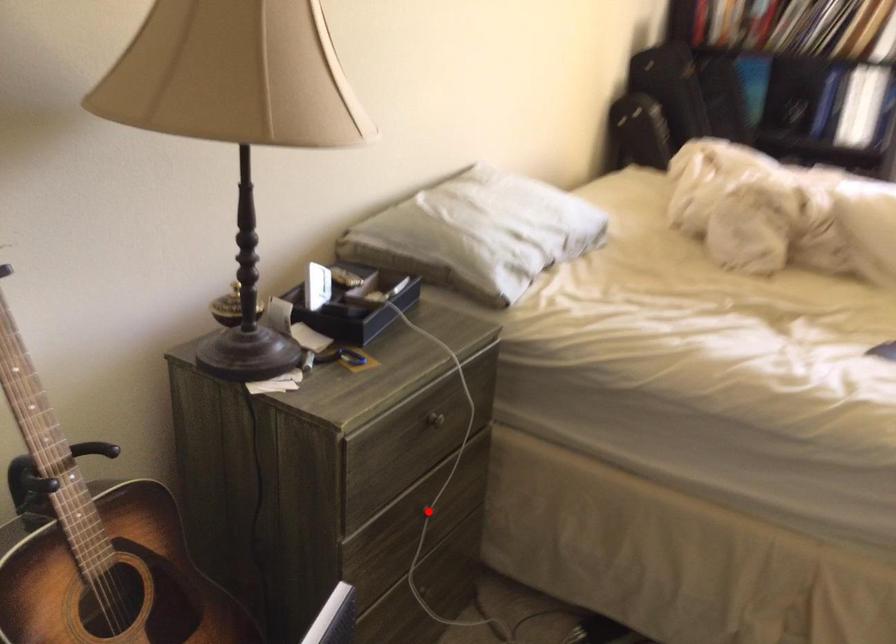
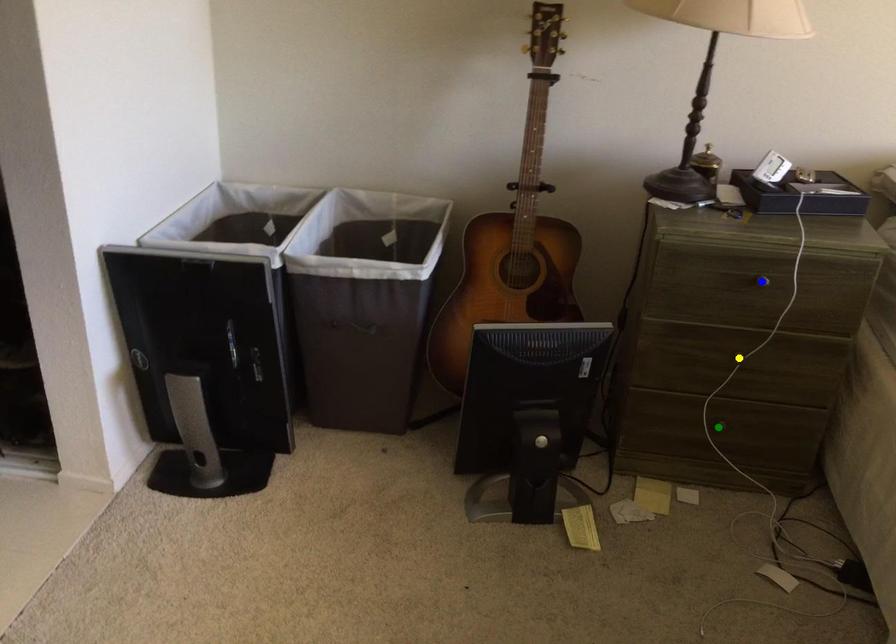
Question: I am providing you with two images of the same scene from different viewpoints. A red point is marked on the first image. You are given multiple points on the second image. Which point in image 2 is actually the same real-world point as the red point in image 1?

Choices:
 (A) blue point
 (B) green point
 (C) yellow point

Answer: (C)